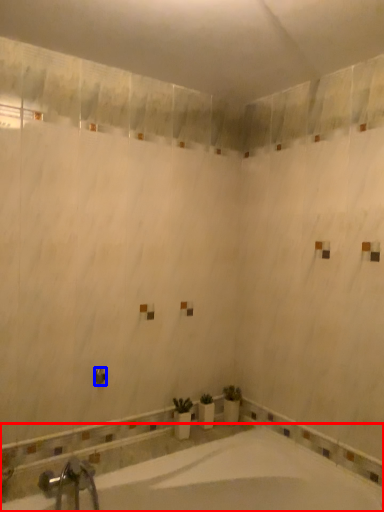
Question: Which object appears closest to the camera in this image, bathtub (highlighted by a red box) or shower (highlighted by a blue box)?

Choices:
 (A) bathtub
 (B) shower

Answer: (A)